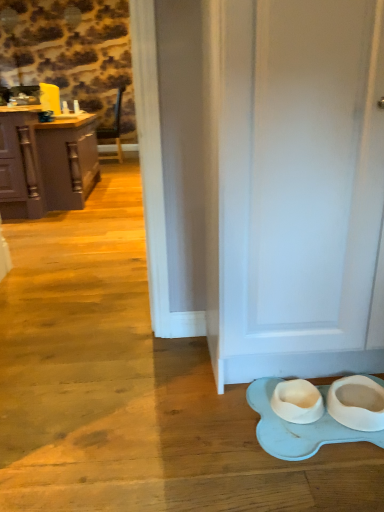
Question: Is white matte door at lower right taller or shorter than matte gray cabinets at left?

Choices:
 (A) tall
 (B) short

Answer: (A)

Question: From the image's perspective, is white matte door at lower right positioned above or below matte gray cabinets at left?

Choices:
 (A) below
 (B) above

Answer: (A)

Question: Considering the positions of point (266, 359) and point (13, 169), is point (266, 359) closer or farther from the camera than point (13, 169)?

Choices:
 (A) farther
 (B) closer

Answer: (B)

Question: Does point (87, 158) appear closer or farther from the camera than point (327, 181)?

Choices:
 (A) closer
 (B) farther

Answer: (B)

Question: Would you say matte gray cabinets at left is to the left or to the right of white matte door at lower right in the picture?

Choices:
 (A) left
 (B) right

Answer: (A)

Question: In the image, is matte gray cabinets at left positioned in front of or behind white matte door at lower right?

Choices:
 (A) behind
 (B) front

Answer: (A)

Question: Is matte gray cabinets at left wider or thinner than white matte door at lower right?

Choices:
 (A) thin
 (B) wide

Answer: (B)